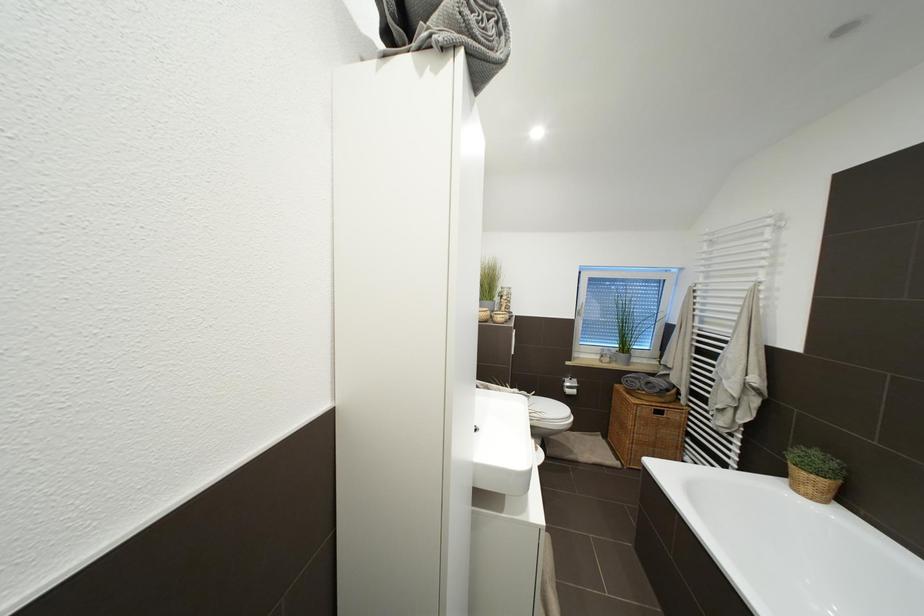
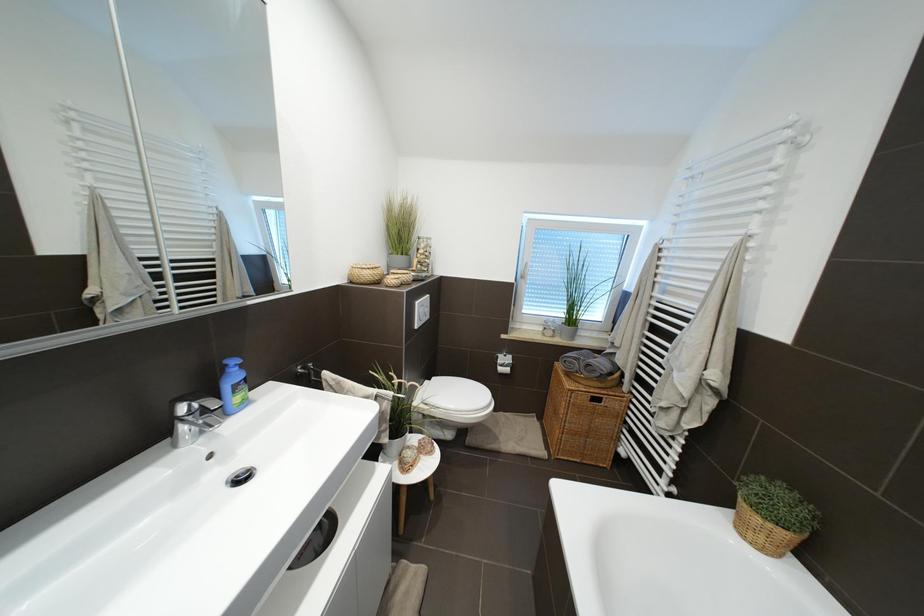
The images are taken continuously from a first-person perspective. In which direction are you moving?

The cameraman moved toward right, forward.